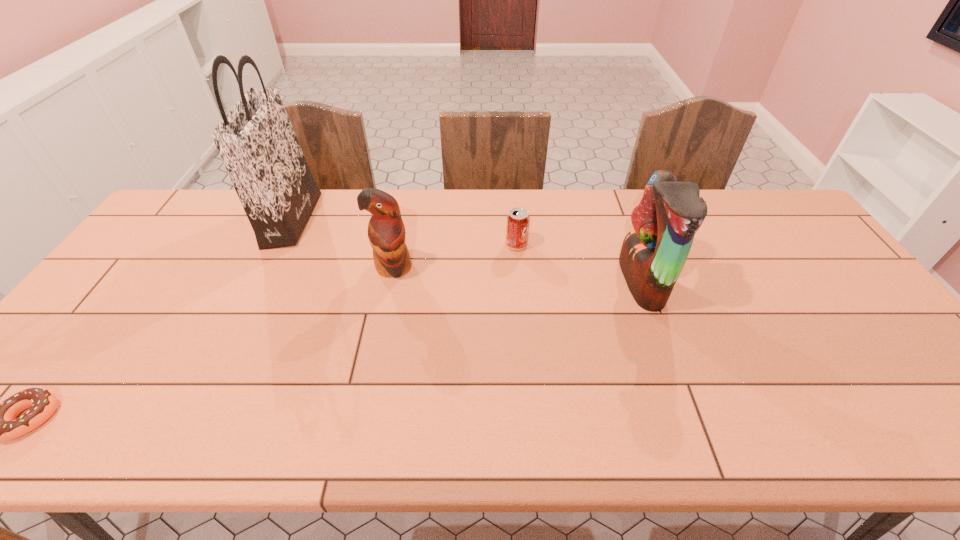
I want to click on vacant area located at the face of the right parrot, so click(x=541, y=282).

At what (x,y) coordinates should I click in order to perform the action: click on free region located on the face of the shorter parrot. Please return your answer as a coordinate pair (x, y). Image resolution: width=960 pixels, height=540 pixels. Looking at the image, I should click on (368, 394).

This screenshot has width=960, height=540. I want to click on vacant point located 0.240m on the right of the second shortest object, so click(605, 245).

Find the location of a particular element. The width and height of the screenshot is (960, 540). object that is at the far edge is located at coordinates (256, 141).

The width and height of the screenshot is (960, 540). I want to click on free space at the far edge of the desktop, so click(x=215, y=219).

Locate an element on the screen. The image size is (960, 540). free space at the near edge of the desktop is located at coordinates (846, 416).

Locate an element on the screen. vacant space at the left edge is located at coordinates (108, 359).

Find the location of a particular element. vacant area at the right edge of the desktop is located at coordinates (896, 398).

At what (x,y) coordinates should I click in order to perform the action: click on free region at the far left corner of the desktop. Please return your answer as a coordinate pair (x, y). This screenshot has width=960, height=540. Looking at the image, I should click on (186, 219).

Find the location of a particular element. The height and width of the screenshot is (540, 960). blank region between the tallest object and the right parrot is located at coordinates (467, 251).